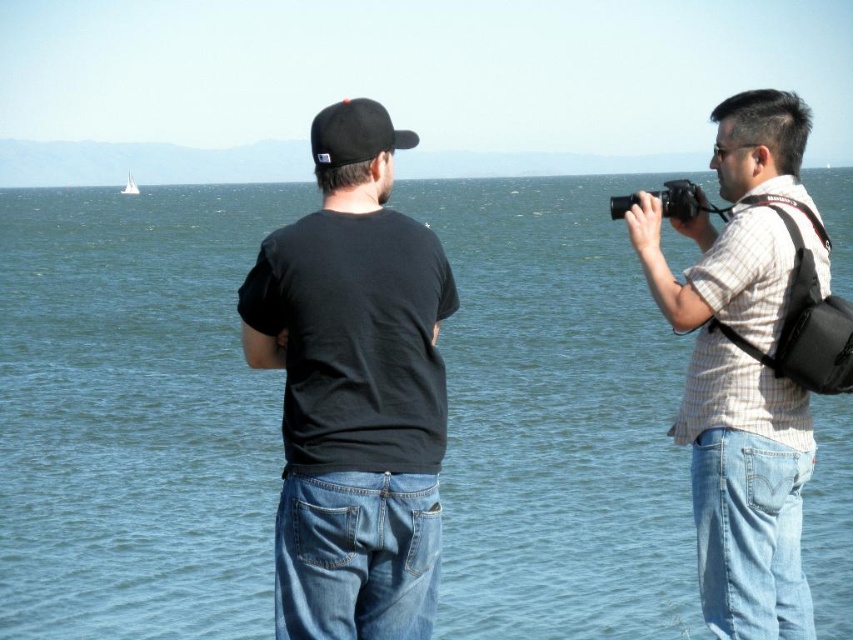
Question: Which object appears farthest from the camera in this image?

Choices:
 (A) black plastic camera at right
 (B) blue water at upper center
 (C) white sailboat at upper left

Answer: (B)

Question: Among these points, which one is farthest from the camera?

Choices:
 (A) (141, 634)
 (B) (338, 166)
 (C) (123, 186)
 (D) (270, 164)

Answer: (D)

Question: Does blue water at center have a greater width compared to black matte t-shirt at center?

Choices:
 (A) yes
 (B) no

Answer: (A)

Question: In this image, where is blue water at center located relative to black plastic camera at right?

Choices:
 (A) left
 (B) right

Answer: (A)

Question: Can you confirm if blue water at center is positioned above blue water at upper center?

Choices:
 (A) yes
 (B) no

Answer: (B)

Question: Which object appears farthest from the camera in this image?

Choices:
 (A) blue water at upper center
 (B) black plastic camera at right
 (C) white sailboat at upper left

Answer: (A)